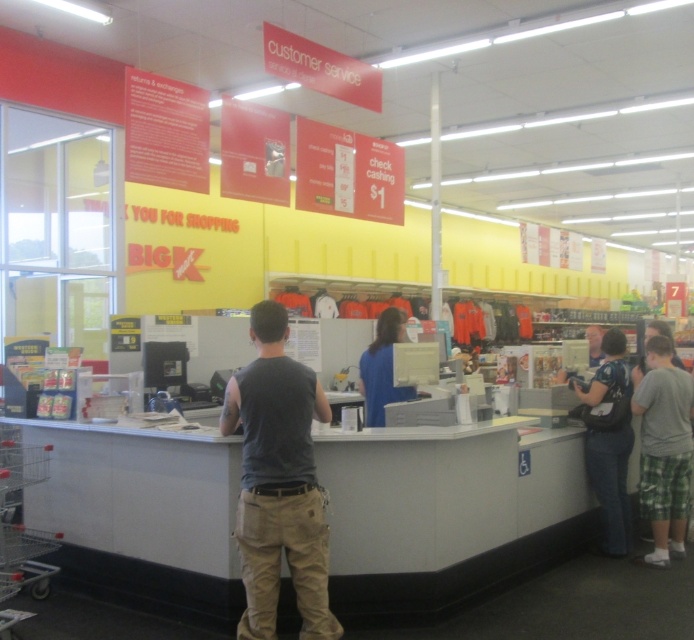
From the picture: You are a customer at the store and want to know what the man is wearing. Based on the scene, which item is shorter in length between the gray cotton tank top at center and the denim pants at lower right?

The gray cotton tank top at center is shorter than the denim pants at lower right.

You are a customer at the Big K store and want to ask the cashier a question. You see the gray cotton tank top at center and the blue fabric shirt at center. Which one is closer to you?

The gray cotton tank top at center is closer to you because it is in front of the blue fabric shirt at center.